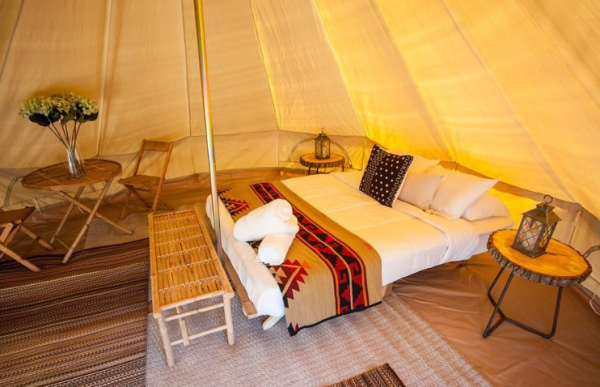
You are a GUI agent. You are given a task and a screenshot of the screen. Output one action in this format:
    pyautogui.click(x=<x>, y=<y>)
    Task: Click on the chairs
    The image size is (600, 387).
    Given the screenshot: What is the action you would take?
    (x=18, y=212), (x=146, y=183)